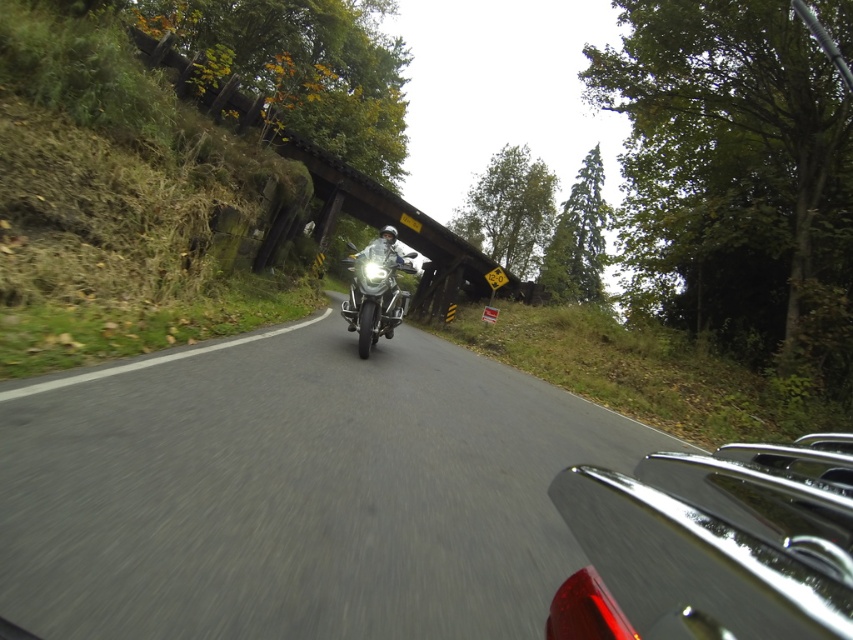
Question: Estimate the real-world distances between objects in this image. Which object is closer to the wooden bridge at center?

Choices:
 (A) shiny chrome motorcycle at center
 (B) black asphalt road at center

Answer: (B)

Question: Can you confirm if wooden bridge at center is positioned below shiny chrome motorcycle at center?

Choices:
 (A) no
 (B) yes

Answer: (A)

Question: Which object appears closest to the camera in this image?

Choices:
 (A) black asphalt road at center
 (B) shiny chrome motorcycle at center

Answer: (A)

Question: Which of the following is the closest to the observer?

Choices:
 (A) click(395, 305)
 (B) click(500, 289)
 (C) click(424, 573)

Answer: (C)

Question: Does wooden bridge at center have a larger size compared to shiny chrome motorcycle at center?

Choices:
 (A) yes
 (B) no

Answer: (A)

Question: Is black asphalt road at center smaller than wooden bridge at center?

Choices:
 (A) no
 (B) yes

Answer: (B)